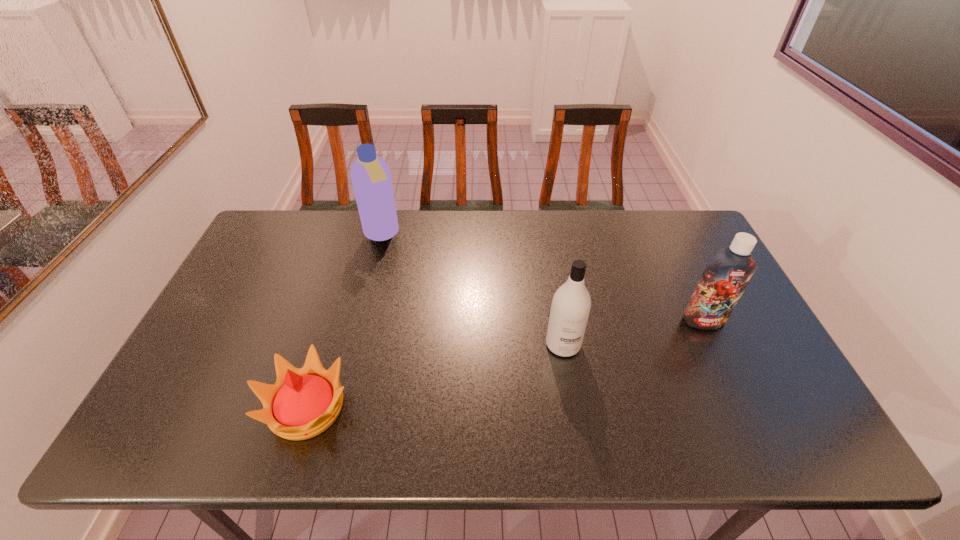
Identify the location of vacant space that's between the rightmost shampoo and the second shampoo from left to right. (634, 333).

The height and width of the screenshot is (540, 960). I want to click on free space between the farthest shampoo and the rightmost shampoo, so click(542, 278).

At what (x,y) coordinates should I click in order to perform the action: click on vacant space that's between the rightmost object and the third object from left to right. Please return your answer as a coordinate pair (x, y). Looking at the image, I should click on (634, 333).

Image resolution: width=960 pixels, height=540 pixels. I want to click on empty space between the second shampoo from left to right and the rightmost object, so click(x=634, y=333).

You are a GUI agent. You are given a task and a screenshot of the screen. Output one action in this format:
    pyautogui.click(x=<x>, y=<y>)
    Task: Click on the vacant area that lies between the farthest object and the second shampoo from left to right
    This screenshot has height=540, width=960.
    Given the screenshot: What is the action you would take?
    pyautogui.click(x=472, y=289)

Locate an element on the screen. The height and width of the screenshot is (540, 960). vacant area between the farthest shampoo and the rightmost shampoo is located at coordinates (542, 278).

In order to click on vacant space in between the crown and the leftmost shampoo in this screenshot , I will do `click(345, 321)`.

Find the location of `unoccupied area between the farthest object and the rightmost object`. unoccupied area between the farthest object and the rightmost object is located at coordinates (542, 278).

Locate an element on the screen. The width and height of the screenshot is (960, 540). free space between the third object from left to right and the rightmost object is located at coordinates (634, 333).

Where is `object that ranks as the third closest to the farthest shampoo`? The height and width of the screenshot is (540, 960). object that ranks as the third closest to the farthest shampoo is located at coordinates (726, 275).